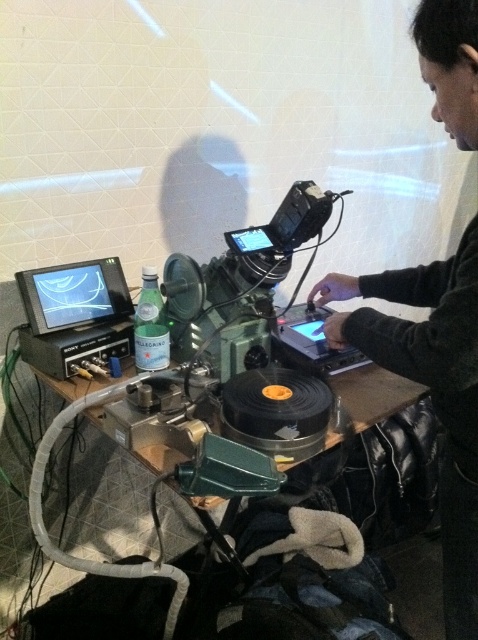
Consider the image. You are an audio technician who needs to place a new microphone stand on the wooden table at center. The stand requires at least 30 cm of clear space. Is there enough space next to the dark gray sweater at center?

The dark gray sweater at center is positioned on the right side of wooden table at center, but the exact dimensions of the table and the sweater are not provided. Without knowing the table size or the sweater size, it is impossible to determine if there is enough space for the microphone stand.

You are a technician setting up for a live performance. You need to place a new microphone stand exactly at the point with coordinates point (241, 269). However, there is already a metallic black video camera at center. Is the point where you want to place the microphone stand occupied by the camera?

The point (241, 269) is on metallic black video camera at center, so yes, the point is occupied by the camera.

You are setting up a live performance and need to place a metallic black video camera at center and a wooden table at center. The space between them must be exactly 20 centimeters for proper alignment. Is the current distance sufficient?

The metallic black video camera at center and wooden table at center are 20.82 centimeters apart, which is slightly more than the required 20 centimeters. Adjust the placement to reduce the distance by 0.82 centimeters for proper alignment.